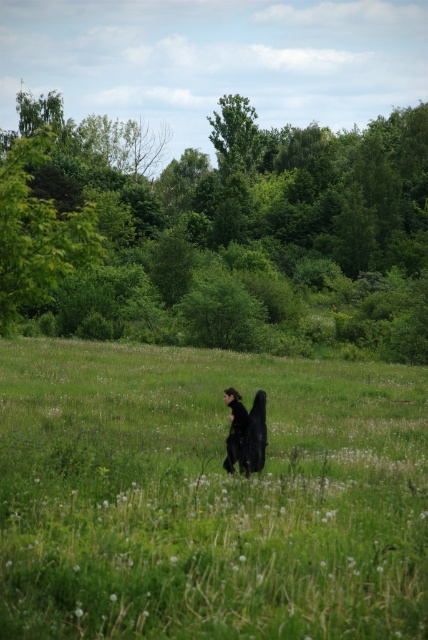
Question: Is green grass at center thinner than green leafy tree at center?

Choices:
 (A) yes
 (B) no

Answer: (A)

Question: Does green leafy tree at center have a lesser width compared to green leafy tree at left?

Choices:
 (A) no
 (B) yes

Answer: (A)

Question: Considering the relative positions of green leafy tree at center and green leafy tree at left in the image provided, where is green leafy tree at center located with respect to green leafy tree at left?

Choices:
 (A) above
 (B) below

Answer: (A)

Question: Which object is closer to the camera taking this photo?

Choices:
 (A) green leafy tree at center
 (B) green grass at center

Answer: (B)

Question: Which point is closer to the camera?

Choices:
 (A) (39, 492)
 (B) (217, 118)
 (C) (47, 128)

Answer: (A)

Question: Which of the following is the closest to the observer?

Choices:
 (A) (275, 259)
 (B) (32, 136)
 (C) (163, 488)

Answer: (C)